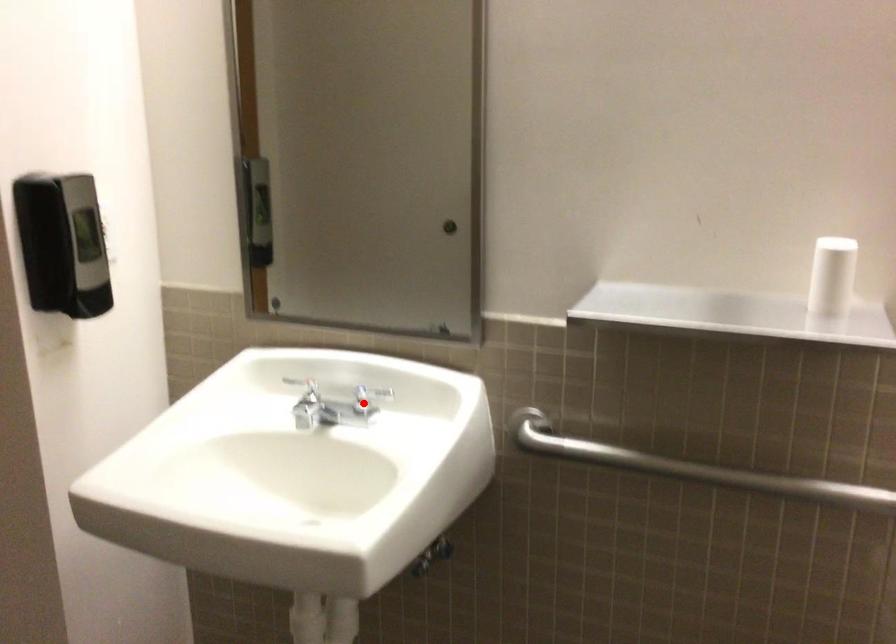
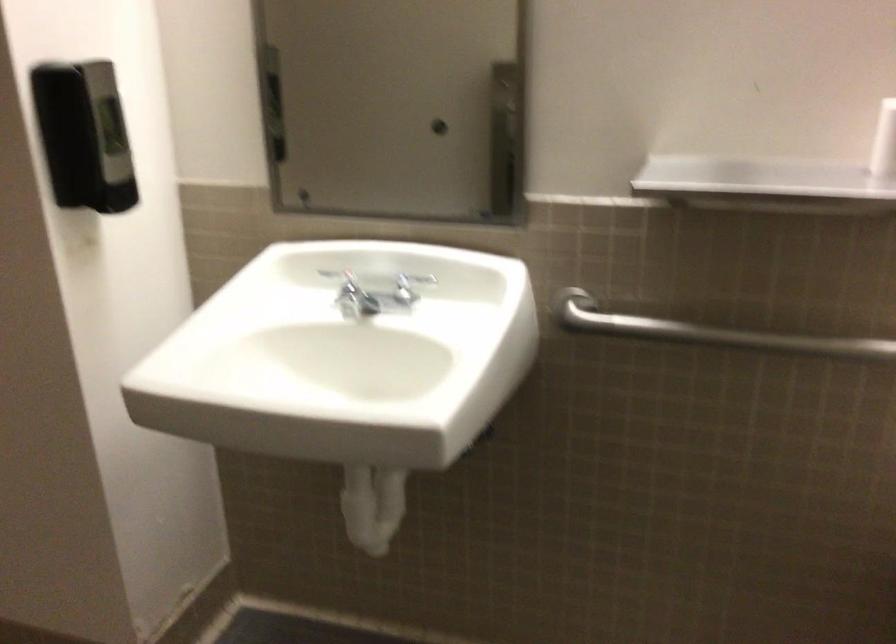
Find the pixel in the second image that matches the highlighted location in the first image.

(403, 290)